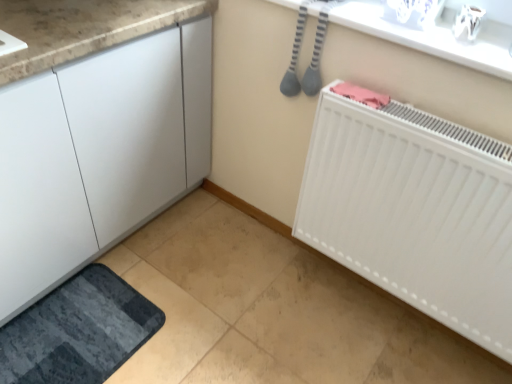
Question: Would you say white matte radiator at lower right is outside dark gray textured bath mat at lower left?

Choices:
 (A) no
 (B) yes

Answer: (B)

Question: From the image's perspective, is white matte radiator at lower right above dark gray textured bath mat at lower left?

Choices:
 (A) no
 (B) yes

Answer: (B)

Question: Considering the relative sizes of white matte radiator at lower right and dark gray textured bath mat at lower left in the image provided, is white matte radiator at lower right shorter than dark gray textured bath mat at lower left?

Choices:
 (A) yes
 (B) no

Answer: (B)

Question: Could dark gray textured bath mat at lower left be considered to be inside white matte radiator at lower right?

Choices:
 (A) no
 (B) yes

Answer: (A)

Question: Is white matte radiator at lower right facing towards dark gray textured bath mat at lower left?

Choices:
 (A) no
 (B) yes

Answer: (A)

Question: From the image's perspective, is white glossy counter top at upper center located above or below white matte radiator at lower right?

Choices:
 (A) above
 (B) below

Answer: (A)

Question: Which is correct: white glossy counter top at upper center is inside white matte radiator at lower right, or outside of it?

Choices:
 (A) outside
 (B) inside

Answer: (A)

Question: From their relative heights in the image, would you say white glossy counter top at upper center is taller or shorter than white matte radiator at lower right?

Choices:
 (A) tall
 (B) short

Answer: (B)

Question: Considering their positions, is white glossy counter top at upper center located in front of or behind white matte radiator at lower right?

Choices:
 (A) front
 (B) behind

Answer: (B)

Question: Based on their positions, is dark gray textured bath mat at lower left located to the left or right of white matte radiator at lower right?

Choices:
 (A) left
 (B) right

Answer: (A)

Question: Is dark gray textured bath mat at lower left situated inside white matte radiator at lower right or outside?

Choices:
 (A) inside
 (B) outside

Answer: (B)

Question: Is dark gray textured bath mat at lower left in front of or behind white matte radiator at lower right in the image?

Choices:
 (A) front
 (B) behind

Answer: (B)

Question: From the image's perspective, is dark gray textured bath mat at lower left located above or below white matte radiator at lower right?

Choices:
 (A) below
 (B) above

Answer: (A)

Question: From their relative heights in the image, would you say white matte radiator at lower right is taller or shorter than white glossy counter top at upper center?

Choices:
 (A) tall
 (B) short

Answer: (A)

Question: Is white matte radiator at lower right in front of or behind white glossy counter top at upper center in the image?

Choices:
 (A) behind
 (B) front

Answer: (B)